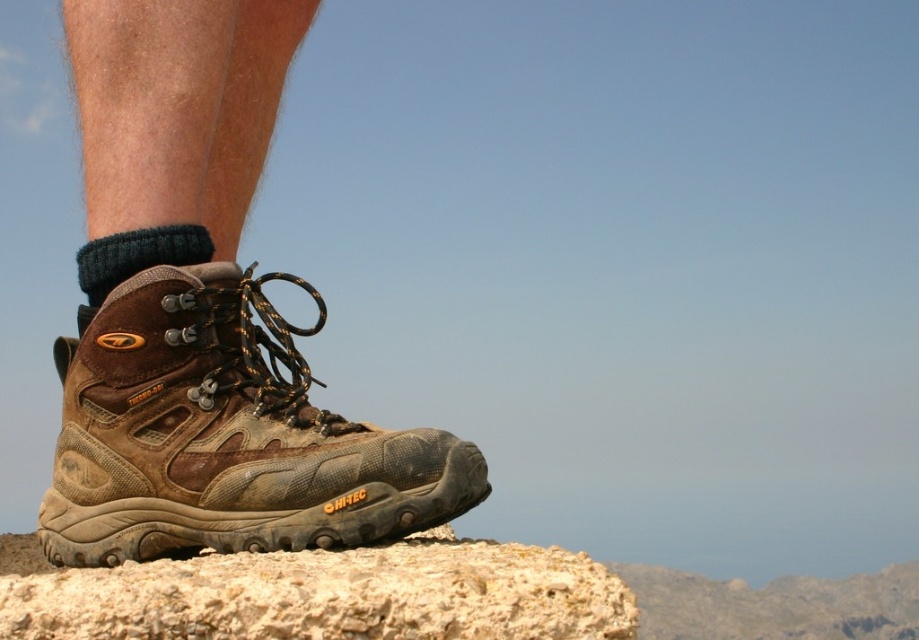
You are a photographer adjusting your camera focus. You need to focus on either the point at (362,582) or the point at (99,294). Which point should you choose if you want to ensure the foreground is in sharp focus?

You should focus on point (362,582) because it is closer to the camera than point (99,294), ensuring the foreground is in sharp focus.

You are a hiker who wants to ensure your footwear is appropriate for the rocky terrain shown in the scene. Based on the brown leather boot at lower left and the dark blue knitted sock at lower left, which item provides better ankle support?

The brown leather boot at lower left provides better ankle support because it has a greater height compared to the dark blue knitted sock at lower left.

You are standing at the camera position and want to reach the point marked at coordinates (x=176, y=365). If your stride length is 0.75 meters, how many steps will it take you to reach that point?

The distance between you and the point is 1.22 meters. Since each step covers 0.75 meters, you would need 2 steps to reach the point marked at coordinates (x=176, y=365).